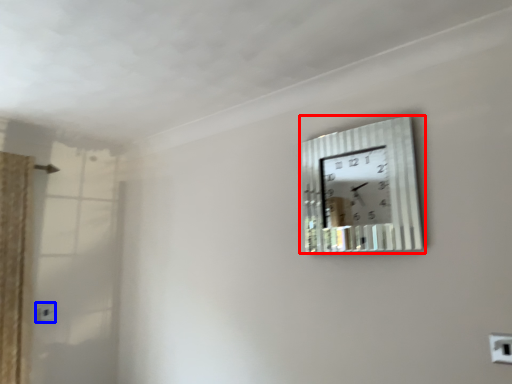
Question: Which point is closer to the camera, wall clock (highlighted by a red box) or electric outlet (highlighted by a blue box)?

Choices:
 (A) wall clock
 (B) electric outlet

Answer: (A)